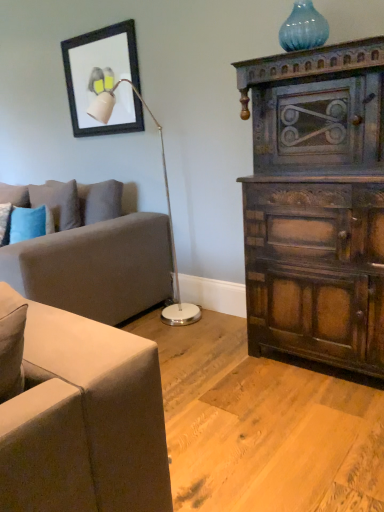
The width and height of the screenshot is (384, 512). I want to click on vacant space in front of dark wood cabinet at right, so click(x=307, y=426).